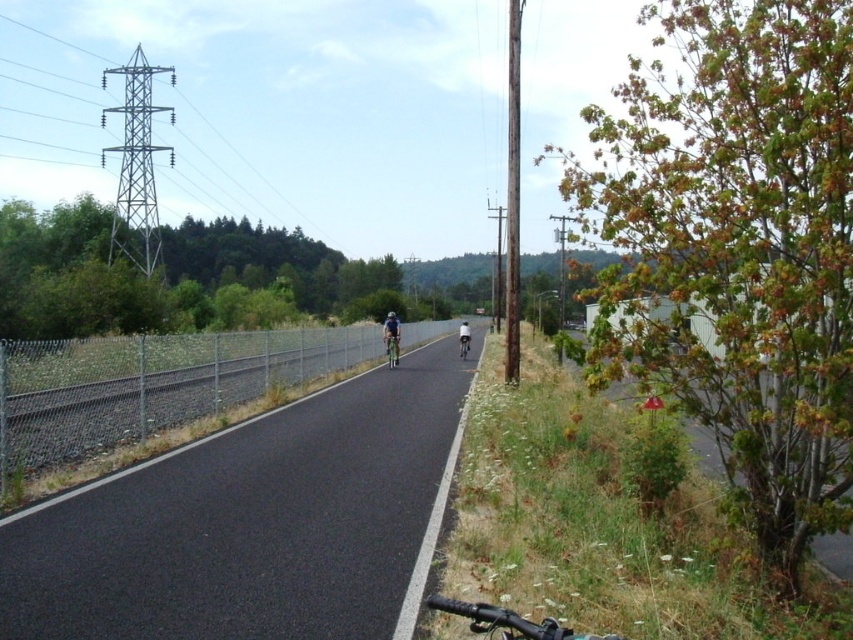
Question: Is metallic silver tower at upper left further to camera compared to green matte bicycle at center?

Choices:
 (A) yes
 (B) no

Answer: (A)

Question: Can you confirm if green matte bicycle at center is bigger than shiny silver bicycle at center?

Choices:
 (A) no
 (B) yes

Answer: (B)

Question: Which point appears closest to the camera in this image?

Choices:
 (A) (387, 355)
 (B) (462, 321)
 (C) (65, 577)
 (D) (393, 314)

Answer: (C)

Question: Based on their relative distances, which object is nearer to the asphalt road at center?

Choices:
 (A) blue fabric helmet at center
 (B) green matte bicycle at center
 (C) white matte bicycle helmet at center

Answer: (B)

Question: Which of the following is the farthest from the observer?

Choices:
 (A) metallic silver tower at upper left
 (B) asphalt road at center
 (C) white matte bicycle helmet at center

Answer: (A)

Question: Considering the relative positions of shiny silver bicycle at center and white matte bicycle helmet at center in the image provided, where is shiny silver bicycle at center located with respect to white matte bicycle helmet at center?

Choices:
 (A) left
 (B) right

Answer: (A)